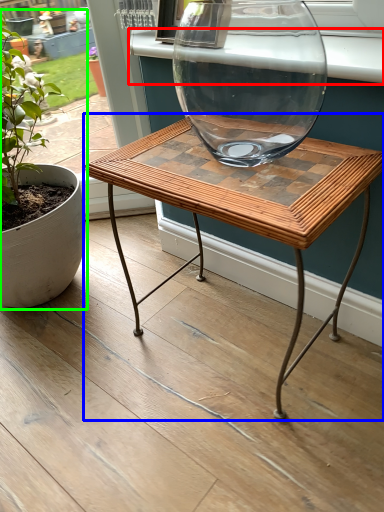
Question: Considering the real-world distances, which object is closest to window sill (highlighted by a red box)? coffee table (highlighted by a blue box) or houseplant (highlighted by a green box).

Choices:
 (A) coffee table
 (B) houseplant

Answer: (A)